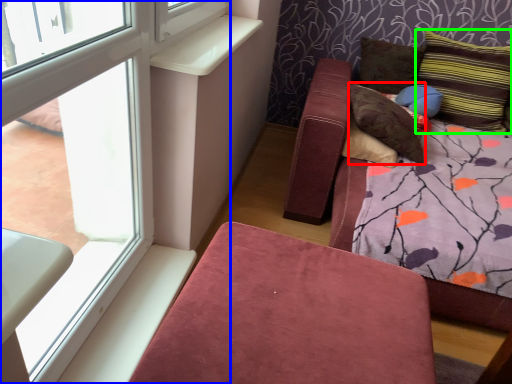
Question: Estimate the real-world distances between objects in this image. Which object is farther from pillow (highlighted by a red box), window (highlighted by a blue box) or pillow (highlighted by a green box)?

Choices:
 (A) window
 (B) pillow

Answer: (A)